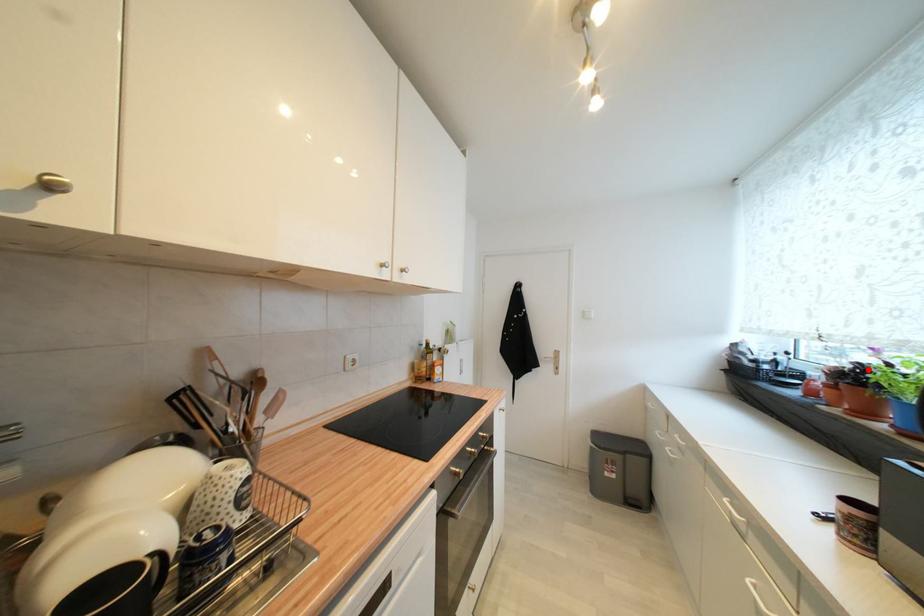
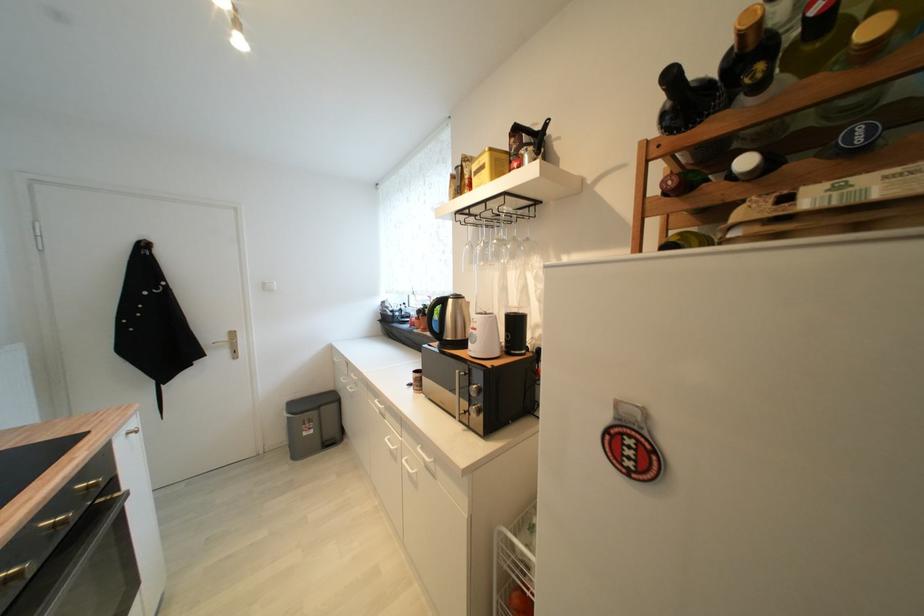
The point at the highlighted location is marked in the first image. Where is the corresponding point in the second image?

(431, 309)